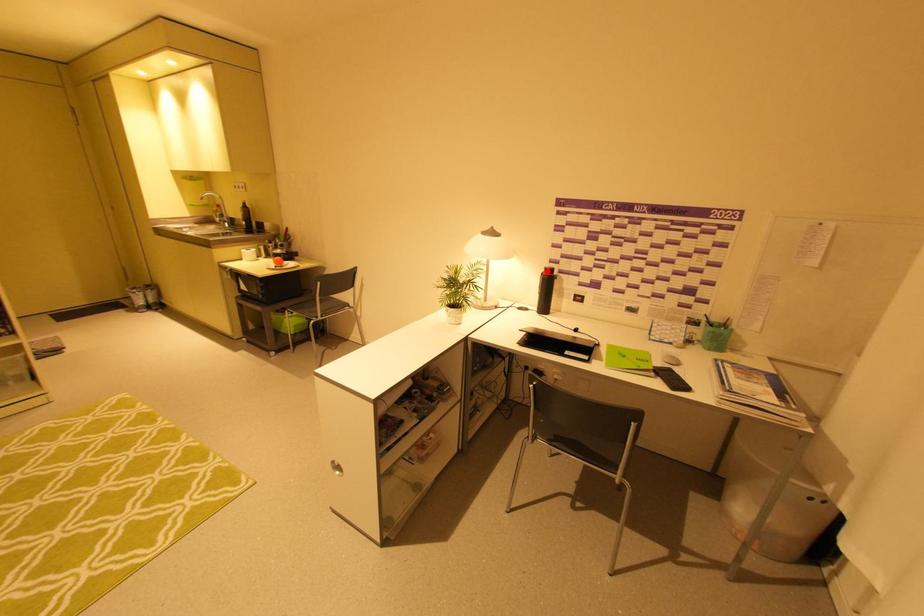
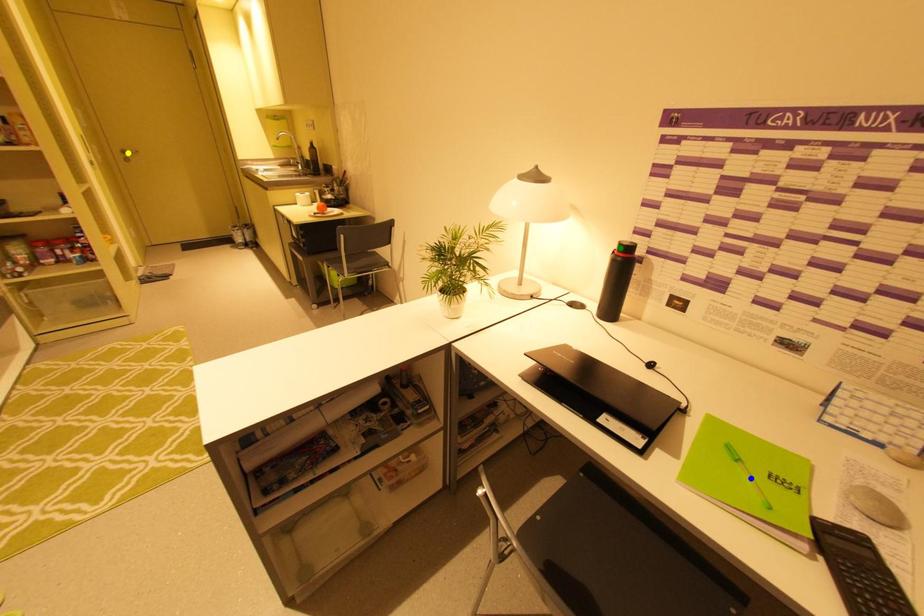
Question: I am providing you with two images of the same scene from different viewpoints. A red point is marked on the first image. You are given multiple points on the second image. In image 2, which mark is for the same physical point as the one in image 1?

Choices:
 (A) yellow point
 (B) green point
 (C) blue point

Answer: (B)